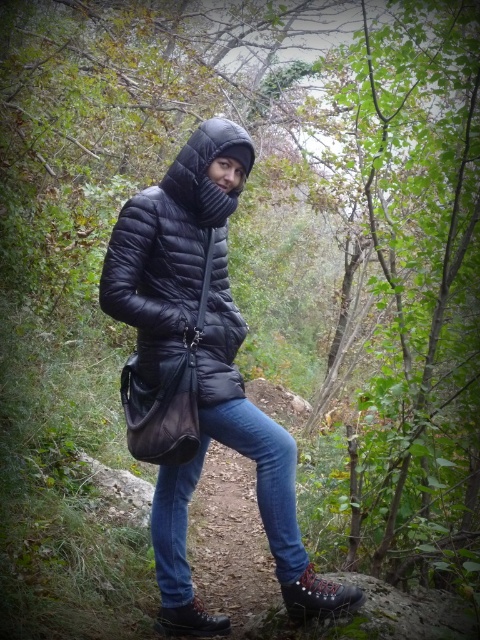
Question: Which point is farther from the camera taking this photo?

Choices:
 (A) (283, 572)
 (B) (172, 372)

Answer: (A)

Question: Is matte black jacket at center wider than matte black puffer jacket at center?

Choices:
 (A) no
 (B) yes

Answer: (B)

Question: In this image, where is matte black puffer jacket at center located relative to black quilted hood at center?

Choices:
 (A) above
 (B) below

Answer: (B)

Question: Which object is positioned closest to the blue denim jeans at center?

Choices:
 (A) black quilted hood at center
 (B) matte black jacket at center
 (C) matte black puffer jacket at center

Answer: (B)

Question: Estimate the real-world distances between objects in this image. Which object is farther from the matte black jacket at center?

Choices:
 (A) matte black puffer jacket at center
 (B) black quilted hood at center

Answer: (B)

Question: Does matte black puffer jacket at center have a larger size compared to blue denim jeans at center?

Choices:
 (A) no
 (B) yes

Answer: (B)